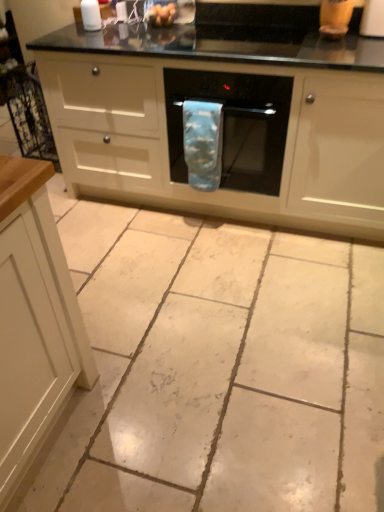
Find the location of a particular element. The image size is (384, 512). empty space that is ontop of white tile floor at center (from a real-world perspective) is located at coordinates (192, 302).